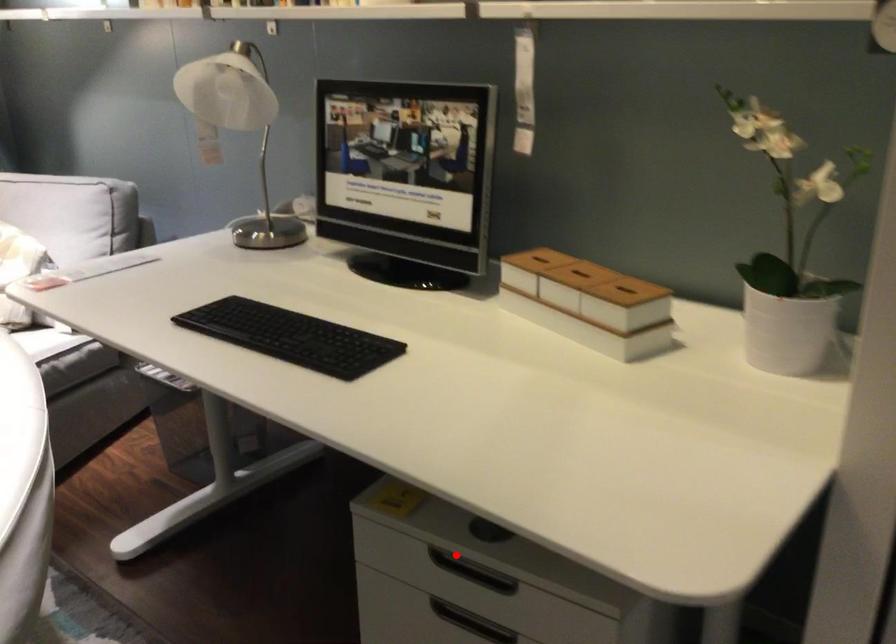
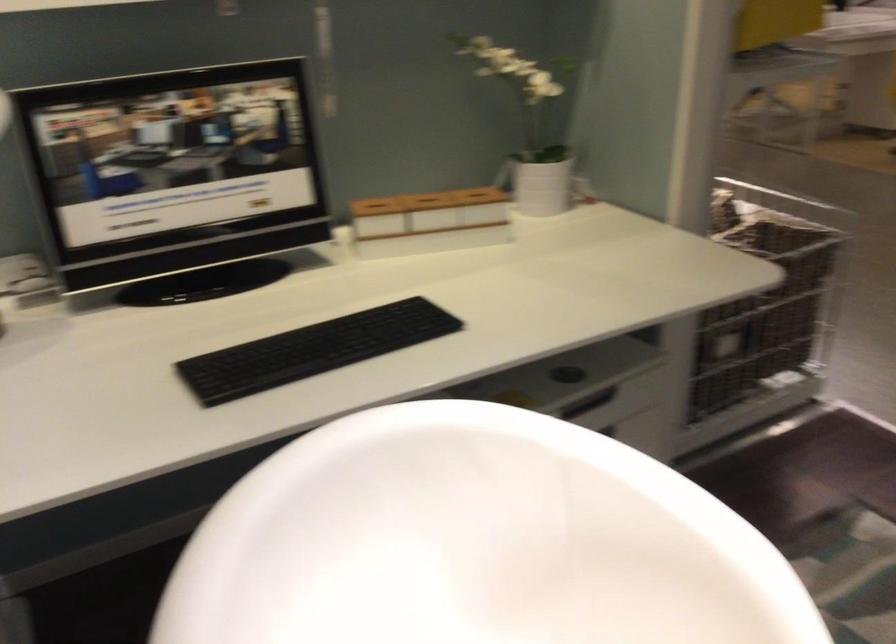
Find the pixel in the second image that matches the highlighted location in the first image.

(588, 402)